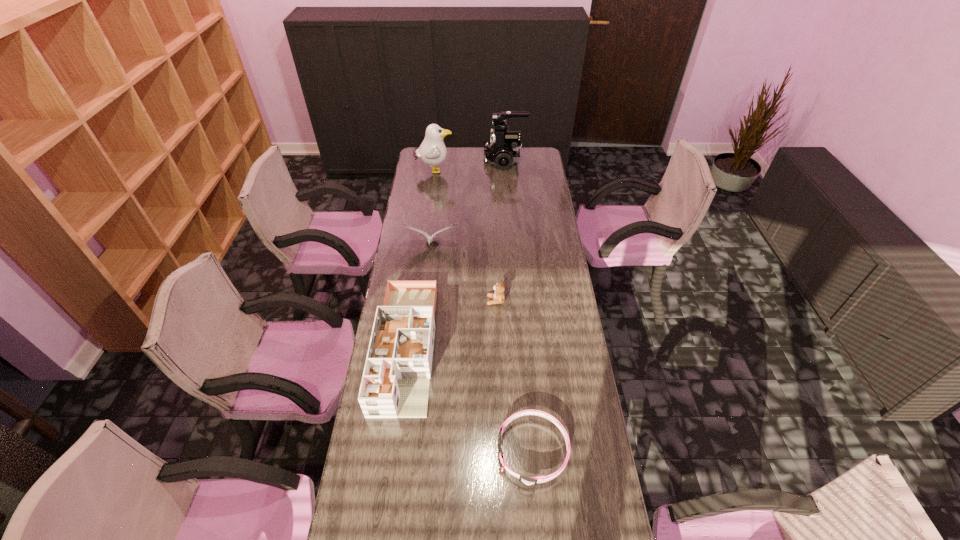
The height and width of the screenshot is (540, 960). I want to click on vacant space situated on the beak of the farther gull, so click(x=514, y=171).

In order to click on vacant space located 0.370m at the tip of the beak of the nearer gull in this screenshot , I will do `click(422, 319)`.

The width and height of the screenshot is (960, 540). Identify the location of free space located 0.280m at the entrance of the dollhouse. (383, 510).

The width and height of the screenshot is (960, 540). In order to click on free space located 0.360m on the front-facing side of the teddy bear in this screenshot , I will do `click(399, 301)`.

You are a GUI agent. You are given a task and a screenshot of the screen. Output one action in this format:
    pyautogui.click(x=<x>, y=<y>)
    Task: Click on the vacant space situated 0.160m on the front-facing side of the teddy bear
    This screenshot has height=540, width=960.
    Given the screenshot: What is the action you would take?
    pyautogui.click(x=448, y=301)

Identify the location of free region located on the front-facing side of the teddy bear. (433, 301).

Identify the location of free location located 0.280m with the buckle on the dog collar. (408, 451).

Find the location of a particular element. vacant space located 0.060m with the buckle on the dog collar is located at coordinates (478, 451).

Locate an element on the screen. This screenshot has width=960, height=540. free point located with the buckle on the dog collar is located at coordinates (398, 451).

I want to click on camcorder located in the far edge section of the desktop, so click(503, 150).